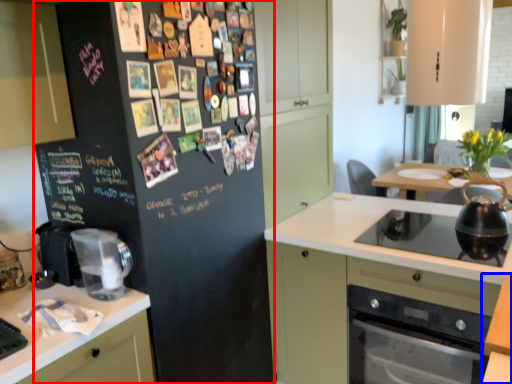
Question: Among these objects, which one is nearest to the camera, refrigerator (highlighted by a red box) or table (highlighted by a blue box)?

Choices:
 (A) refrigerator
 (B) table

Answer: (B)